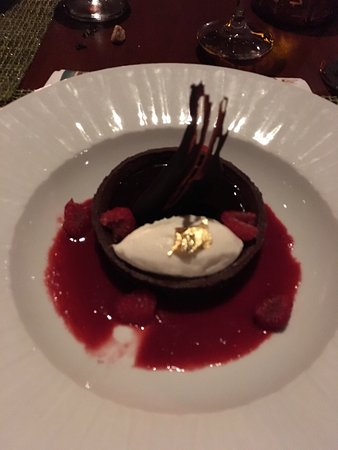
At what (x,y) coordinates should I click in order to perform the action: click on cup. Please return your answer as a coordinate pair (x, y). Image resolution: width=338 pixels, height=450 pixels. Looking at the image, I should click on (117, 264).